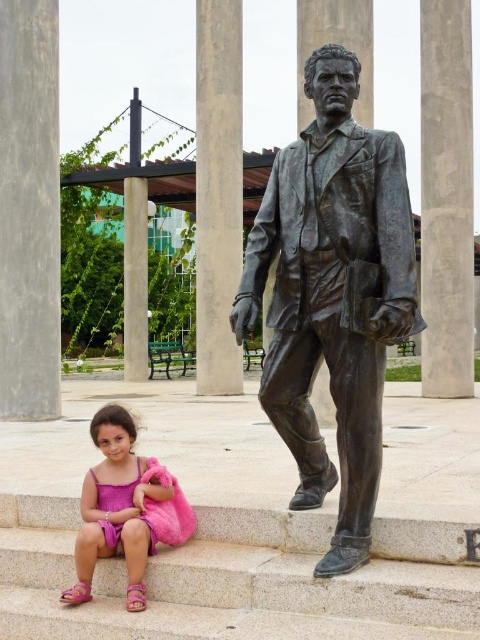
You are standing at the origin point of the coordinate system in the image. You want to walk to the bronze statue at center. What direction should you walk to reach it?

Since the bronze statue at center is located at coordinate point (332, 294), you should walk towards the upper right direction from the origin to reach it.

You are standing at the point with coordinates point [469,44] and want to walk to the point with coordinates point [140,260]. Which direction should you move in?

You should move backward because point [469,44] is in front of point [140,260].